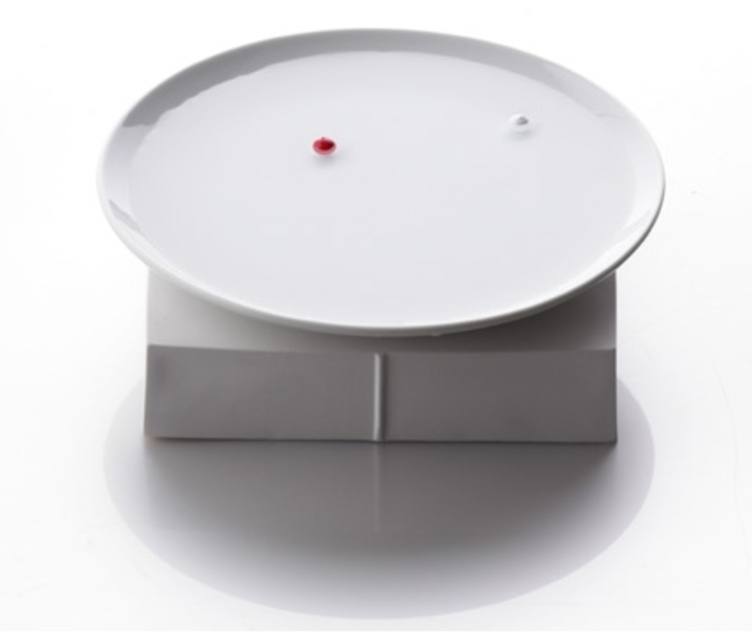
Question: Can you confirm if white glossy lid at center is positioned to the right of matte gray box at center?

Choices:
 (A) no
 (B) yes

Answer: (A)

Question: Which point is closer to the camera taking this photo?

Choices:
 (A) (462, 433)
 (B) (623, 186)

Answer: (B)

Question: Which object is farther from the camera taking this photo?

Choices:
 (A) matte gray box at center
 (B) white glossy lid at center

Answer: (A)

Question: Is the position of white glossy lid at center more distant than that of matte gray box at center?

Choices:
 (A) yes
 (B) no

Answer: (B)

Question: Can you confirm if white glossy lid at center is smaller than matte gray box at center?

Choices:
 (A) yes
 (B) no

Answer: (B)

Question: Which of the following is the closest to the observer?

Choices:
 (A) matte gray box at center
 (B) white glossy lid at center

Answer: (B)